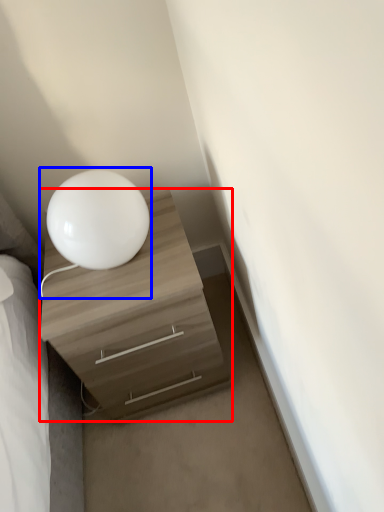
Question: Which of the following is the farthest to the observer, chest of drawers (highlighted by a red box) or table lamp (highlighted by a blue box)?

Choices:
 (A) chest of drawers
 (B) table lamp

Answer: (A)